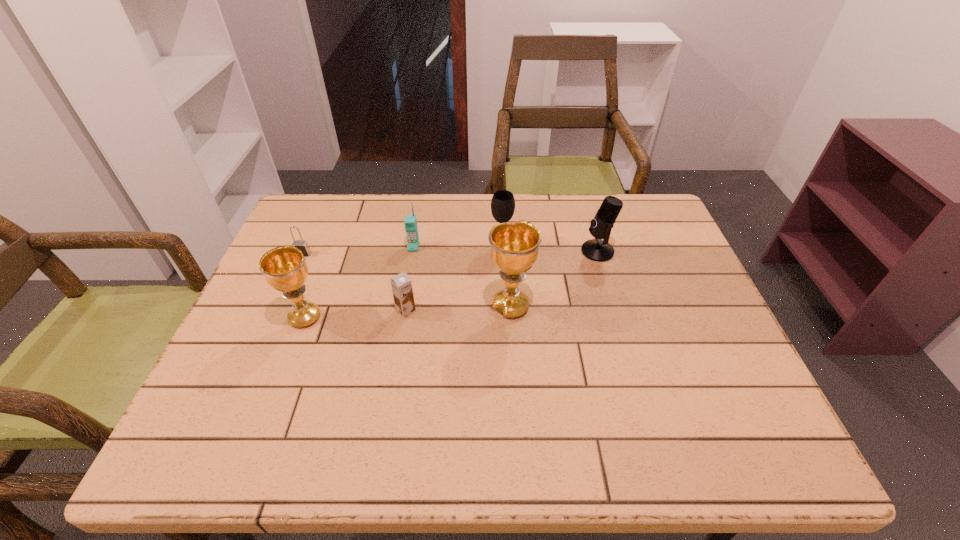
Locate an element on the screen. This screenshot has width=960, height=540. free point between the cellular telephone and the padlock is located at coordinates (358, 251).

Locate an element on the screen. This screenshot has height=540, width=960. free area in between the microphone and the second shortest object is located at coordinates (502, 281).

You are a GUI agent. You are given a task and a screenshot of the screen. Output one action in this format:
    pyautogui.click(x=<x>, y=<y>)
    Task: Click on the free space between the padlock and the cellular telephone
    The image size is (960, 540).
    Given the screenshot: What is the action you would take?
    pyautogui.click(x=358, y=251)

Identify the location of free point between the cellular telephone and the left chalice. This screenshot has height=540, width=960. click(x=359, y=282).

Where is `free space between the right chalice and the microphone`? The image size is (960, 540). free space between the right chalice and the microphone is located at coordinates (554, 279).

This screenshot has height=540, width=960. I want to click on free space between the chocolate milk and the rightmost object, so click(x=502, y=281).

Find the location of a particular element. Image resolution: width=960 pixels, height=540 pixels. object that is the fifth nearest to the padlock is located at coordinates (514, 246).

Locate which object is the sixth closest to the microphone. Please provide its 2D coordinates. Your answer should be formatted as a tuple, i.e. [(x, y)], where the tuple contains the x and y coordinates of a point satisfying the conditions above.

[(302, 245)]

Identify the location of free space that satisfies the following two spatial constraints: 1. on the shackle of the shortest object; 2. on the right side of the tallest object. The image size is (960, 540). (279, 307).

Find the location of `blank space that satisfies the following two spatial constraints: 1. on the keypad of the cellular telephone; 2. on the left side of the second shortest object`. blank space that satisfies the following two spatial constraints: 1. on the keypad of the cellular telephone; 2. on the left side of the second shortest object is located at coordinates (403, 310).